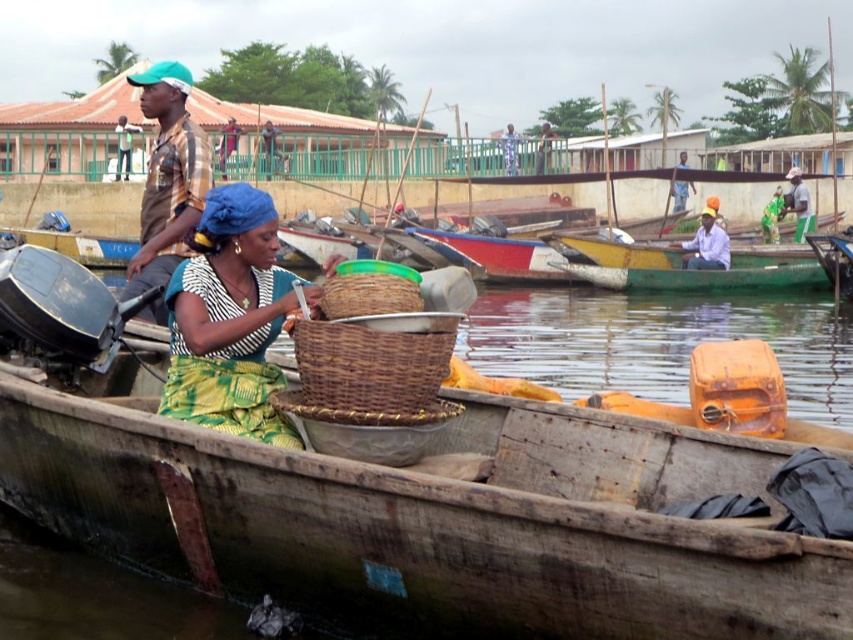
You are a photographer standing on the dock, and you want to take a closeup shot of the blue fabric headscarf at upper center. The camera you have can focus up to 50 meters. Can you capture the headscarf clearly?

The blue fabric headscarf at upper center is 53.13 meters away from the camera, which exceeds the camera focus range of 50 meters. Therefore, you cannot capture the headscarf clearly.

You are standing on the dock and looking at the boat. The boat is in the water. Where is the matte yellow shirt at left located in the image?

The matte yellow shirt at left is located at the 2D coordinates point (167, 177) in the image.

You are a photographer taking a picture of the two people on the boat. You notice the blue fabric headscarf at upper center and the matte blue hat at upper center. Which one is positioned lower in the image?

The blue fabric headscarf at upper center is positioned below the matte blue hat at upper center, so the blue fabric headscarf at upper center is lower in the image.